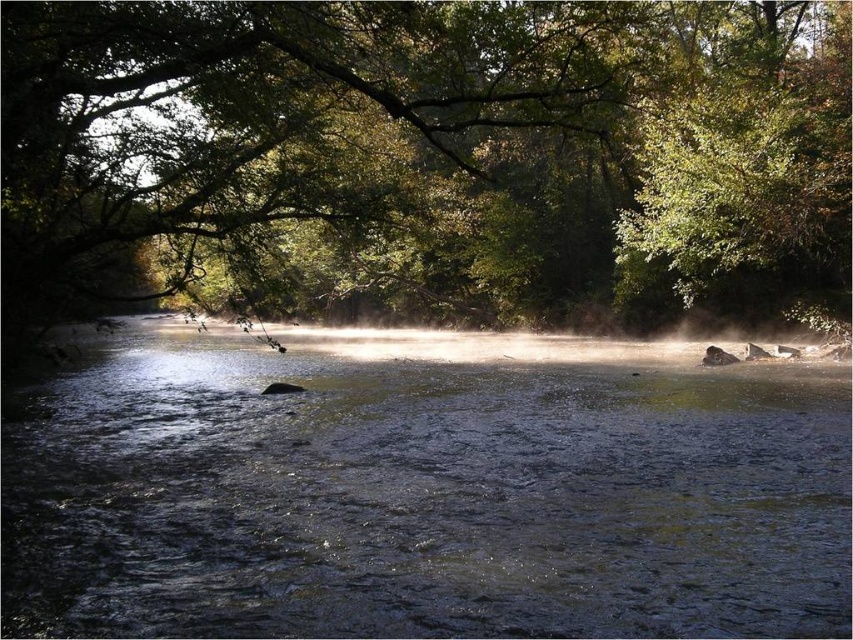
Question: Is green leafy tree at center positioned before clear water at center?

Choices:
 (A) yes
 (B) no

Answer: (B)

Question: Which object is closer to the camera taking this photo?

Choices:
 (A) green leafy tree at center
 (B) clear water at center

Answer: (B)

Question: Does green leafy tree at center appear under clear water at center?

Choices:
 (A) yes
 (B) no

Answer: (B)

Question: Among these objects, which one is nearest to the camera?

Choices:
 (A) clear water at center
 (B) green leafy tree at center

Answer: (A)

Question: From the image, what is the correct spatial relationship of green leafy tree at center in relation to clear water at center?

Choices:
 (A) above
 (B) below

Answer: (A)